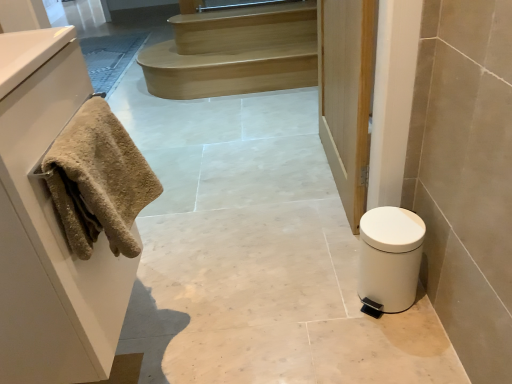
Image resolution: width=512 pixels, height=384 pixels. What do you see at coordinates (389, 259) in the screenshot?
I see `white matte trash can at lower right` at bounding box center [389, 259].

At what (x,y) coordinates should I click in order to perform the action: click on beige textured towel at left. Please return your answer as a coordinate pair (x, y). This screenshot has height=384, width=512. Looking at the image, I should click on (49, 227).

The image size is (512, 384). What do you see at coordinates (49, 227) in the screenshot?
I see `beige textured towel at left` at bounding box center [49, 227].

Locate an element on the screen. This screenshot has height=384, width=512. beige fluffy towel at left is located at coordinates (98, 181).

I want to click on wooden door at center, so click(347, 95).

I want to click on light brown wooden stairs at upper center, so click(234, 52).

Is wooden door at center facing away from beige fluffy towel at left?

No, wooden door at center's orientation is not away from beige fluffy towel at left.

From a real-world perspective, is wooden door at center located higher than beige fluffy towel at left?

Actually, wooden door at center is physically below beige fluffy towel at left in the real world.

Is wooden door at center positioned beyond the bounds of beige fluffy towel at left?

That's correct, wooden door at center is outside of beige fluffy towel at left.

Locate an element on the screen. door behind the beige fluffy towel at left is located at coordinates (347, 95).

From the image's perspective, which is above, beige fluffy towel at left or white matte trash can at lower right?

beige fluffy towel at left, from the image's perspective.

Does beige fluffy towel at left have a greater height compared to white matte trash can at lower right?

No.

Between point (82, 125) and point (411, 290), which one is positioned behind?

The point (411, 290) is farther.

What are the coordinates of `toilet bowl below the beige fluffy towel at left (from a real-world perspective)` in the screenshot? It's located at [389, 259].

Between point (108, 161) and point (50, 78), which one is positioned in front?

The point (50, 78) is closer.

From a real-world perspective, does beige fluffy towel at left sit lower than beige textured towel at left?

No, from a real-world perspective, beige fluffy towel at left is not under beige textured towel at left.

Does beige fluffy towel at left have a greater height compared to beige textured towel at left?

No.

Is beige fluffy towel at left smaller than beige textured towel at left?

Yes, beige fluffy towel at left is smaller than beige textured towel at left.

Considering the sizes of objects white matte trash can at lower right and light brown wooden stairs at upper center in the image provided, who is taller, white matte trash can at lower right or light brown wooden stairs at upper center?

white matte trash can at lower right.

At what (x,y) coordinates should I click in order to perform the action: click on stairs that is above the white matte trash can at lower right (from a real-world perspective). Please return your answer as a coordinate pair (x, y). The height and width of the screenshot is (384, 512). Looking at the image, I should click on (234, 52).

Looking at this image, is white matte trash can at lower right oriented towards light brown wooden stairs at upper center?

No.

In the scene shown: Is white matte trash can at lower right completely or partially outside of light brown wooden stairs at upper center?

Yes, white matte trash can at lower right is located beyond the bounds of light brown wooden stairs at upper center.

Is beige fluffy towel at left bigger than light brown wooden stairs at upper center?

Actually, beige fluffy towel at left might be smaller than light brown wooden stairs at upper center.

Considering the points (106, 135) and (137, 60), which point is behind, point (106, 135) or point (137, 60)?

The point (137, 60) is farther from the camera.

Considering the positions of objects beige fluffy towel at left and light brown wooden stairs at upper center in the image provided, who is more to the left, beige fluffy towel at left or light brown wooden stairs at upper center?

beige fluffy towel at left.

Based on the photo, how much distance is there between beige fluffy towel at left and light brown wooden stairs at upper center?

A distance of 2.09 meters exists between beige fluffy towel at left and light brown wooden stairs at upper center.

Do you think light brown wooden stairs at upper center is within wooden door at center, or outside of it?

light brown wooden stairs at upper center is outside wooden door at center.

How far apart are light brown wooden stairs at upper center and wooden door at center?

1.18 meters.

Looking at this image, would you say light brown wooden stairs at upper center is a long distance from wooden door at center?

Absolutely, light brown wooden stairs at upper center is distant from wooden door at center.

Looking at this image, can you tell me how much light brown wooden stairs at upper center and wooden door at center differ in facing direction?

90.8 degrees separate the facing orientations of light brown wooden stairs at upper center and wooden door at center.

Considering the positions of objects white matte trash can at lower right and wooden door at center in the image provided, who is behind, white matte trash can at lower right or wooden door at center?

wooden door at center is further from the camera.

From the image's perspective, which object appears higher, white matte trash can at lower right or wooden door at center?

wooden door at center is shown above in the image.

Is wooden door at center inside white matte trash can at lower right?

No, wooden door at center is located outside of white matte trash can at lower right.

Are white matte trash can at lower right and wooden door at center far apart?

No, white matte trash can at lower right is not far away from wooden door at center.

The image size is (512, 384). Identify the location of towel that appears above the wooden door at center (from a real-world perspective). (98, 181).

Locate an element on the screen. This screenshot has width=512, height=384. towel located above the white matte trash can at lower right (from the image's perspective) is located at coordinates (98, 181).

Which object lies further to the anchor point white matte trash can at lower right, wooden door at center or beige fluffy towel at left?

beige fluffy towel at left lies further to white matte trash can at lower right than the other object.

From the image, which object appears to be nearer to beige fluffy towel at left, light brown wooden stairs at upper center or white matte trash can at lower right?

The object closer to beige fluffy towel at left is white matte trash can at lower right.

Based on their spatial positions, is white matte trash can at lower right or light brown wooden stairs at upper center closer to beige textured towel at left?

white matte trash can at lower right lies closer to beige textured towel at left than the other object.

Based on their spatial positions, is wooden door at center or light brown wooden stairs at upper center further from beige textured towel at left?

light brown wooden stairs at upper center.

Estimate the real-world distances between objects in this image. Which object is further from beige textured towel at left, wooden door at center or beige fluffy towel at left?

wooden door at center is further to beige textured towel at left.

Based on their spatial positions, is beige fluffy towel at left or white matte trash can at lower right closer to wooden door at center?

Based on the image, white matte trash can at lower right appears to be nearer to wooden door at center.

When comparing their distances from wooden door at center, does light brown wooden stairs at upper center or white matte trash can at lower right seem closer?

white matte trash can at lower right.

Based on their spatial positions, is beige fluffy towel at left or light brown wooden stairs at upper center closer to beige textured towel at left?

beige fluffy towel at left.

In order to click on towel between beige textured towel at left and wooden door at center in the horizontal direction in this screenshot , I will do `click(98, 181)`.

Image resolution: width=512 pixels, height=384 pixels. Identify the location of door positioned between beige textured towel at left and light brown wooden stairs at upper center from near to far. (347, 95).

The image size is (512, 384). What are the coordinates of `towel between beige textured towel at left and light brown wooden stairs at upper center from front to back` in the screenshot? It's located at (98, 181).

The image size is (512, 384). What are the coordinates of `towel between beige textured towel at left and white matte trash can at lower right in the horizontal direction` in the screenshot? It's located at click(98, 181).